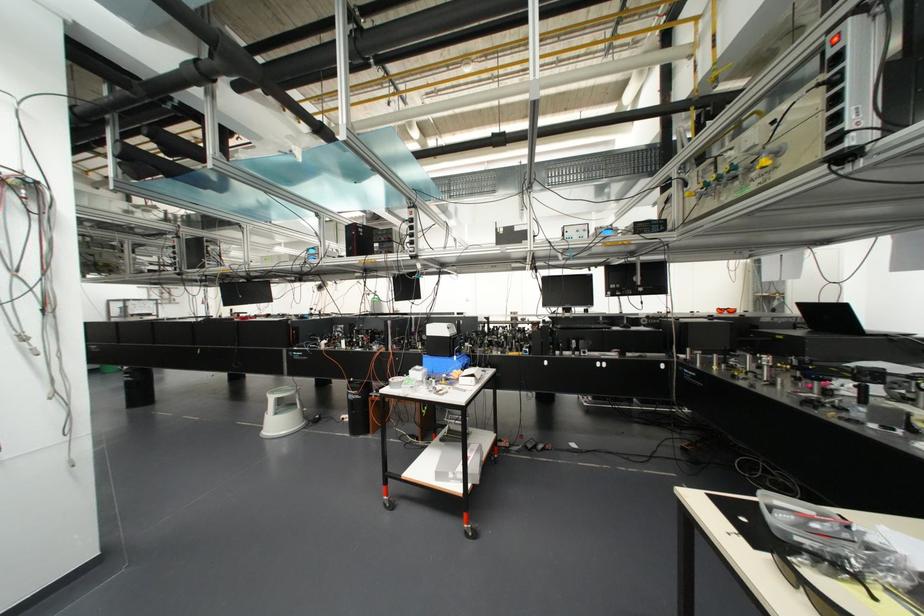
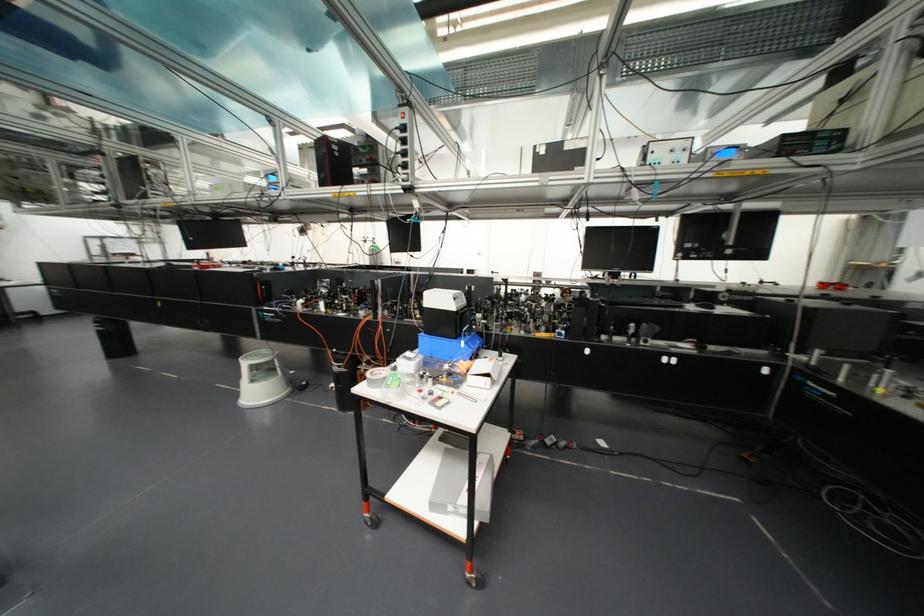
Where in the second image is the point corresponding to (x=438, y=475) from the first image?

(432, 505)